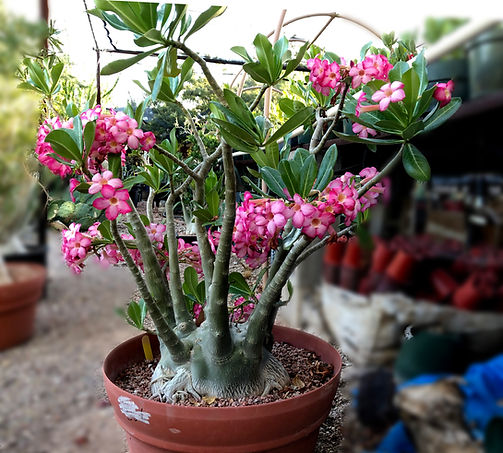
Locate an element on the screen. The image size is (503, 453). red clay pot in background is located at coordinates (22, 317).